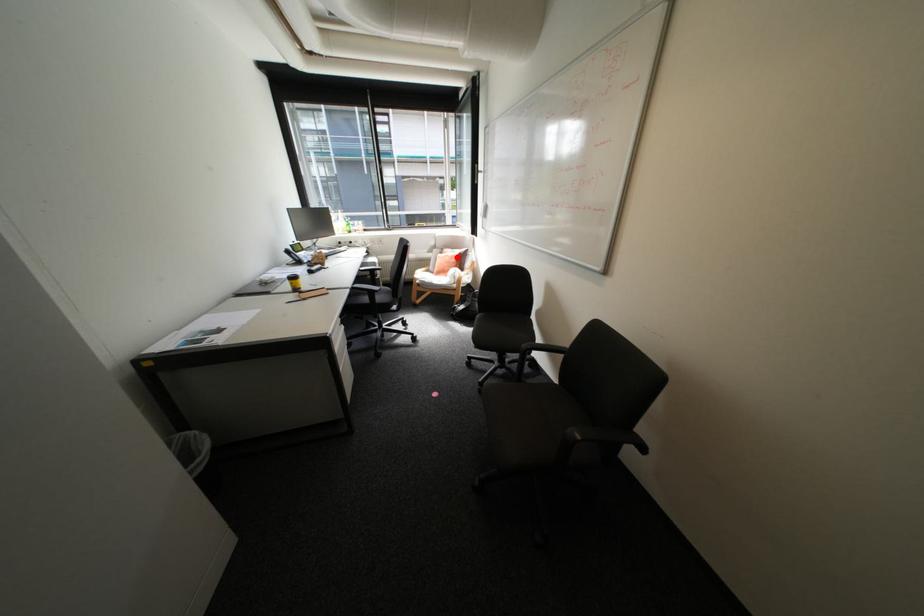
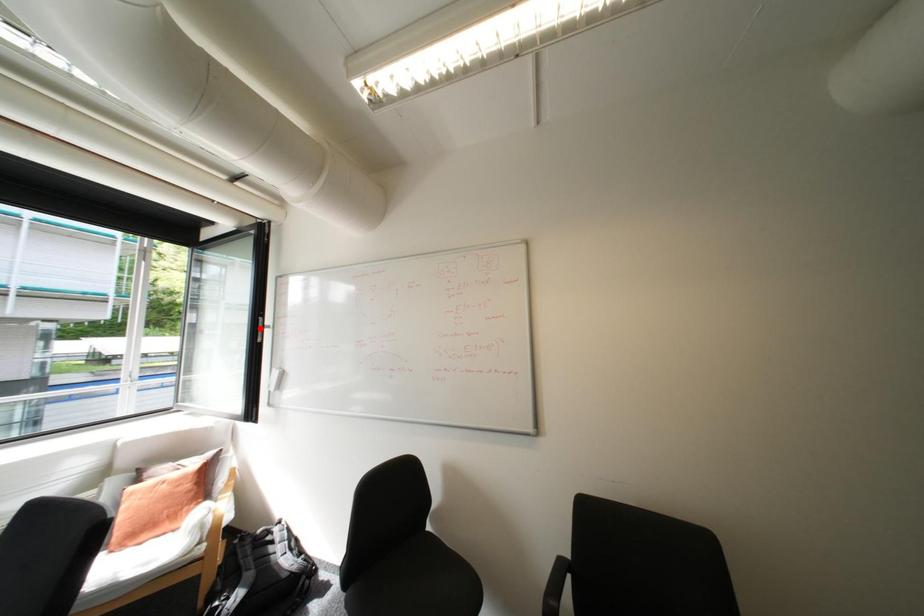
I am providing you with two images of the same scene from different viewpoints. A red point is marked on the first image and another point is marked on the second image. Is the red point in image1 aligned with the point shown in image2?

No